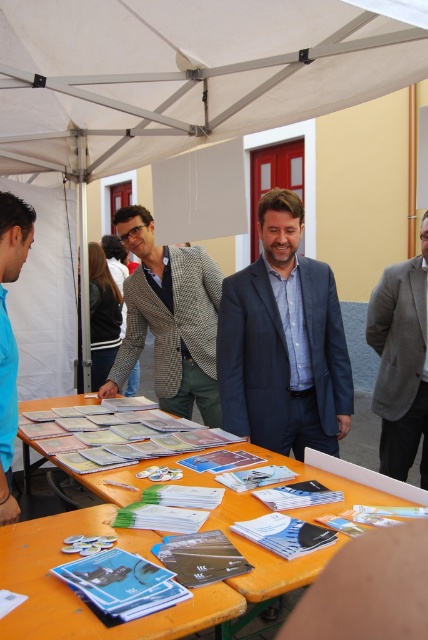
Question: Which point is farther to the camera?

Choices:
 (A) gray woolen blazer at center
 (B) orange paper at lower center
 (C) blue fabric suit at center
 (D) matte houndstooth blazer at center

Answer: (D)

Question: Among these objects, which one is nearest to the camera?

Choices:
 (A) matte houndstooth blazer at center
 (B) gray woolen blazer at center

Answer: (B)

Question: Which of the following is the closest to the observer?

Choices:
 (A) gray woolen blazer at center
 (B) beige fabric canopy at upper center
 (C) matte houndstooth blazer at center

Answer: (B)

Question: Can you confirm if beige fabric canopy at upper center is positioned to the left of blue fabric shirt at left?

Choices:
 (A) no
 (B) yes

Answer: (A)

Question: Considering the relative positions of orange paper at lower center and matte houndstooth blazer at center in the image provided, where is orange paper at lower center located with respect to matte houndstooth blazer at center?

Choices:
 (A) above
 (B) below

Answer: (B)

Question: From the image, what is the correct spatial relationship of blue fabric suit at center in relation to matte paper brochures at center?

Choices:
 (A) above
 (B) below

Answer: (A)